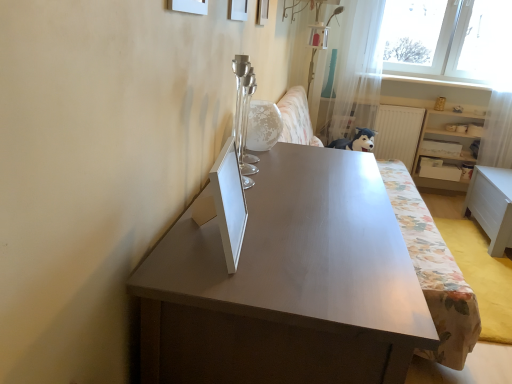
In order to click on white glossy globe at center in this screenshot , I will do tap(262, 126).

What are the coordinates of `white matte picture frame at upper center, arranged as the first picture frame when viewed from the left` in the screenshot? It's located at (189, 6).

You are a GUI agent. You are given a task and a screenshot of the screen. Output one action in this format:
    pyautogui.click(x=<x>, y=<y>)
    Task: Click on the white wooden shelf at right
    The image size is (512, 384).
    Given the screenshot: What is the action you would take?
    pyautogui.click(x=445, y=142)

What do you see at coordinates (445, 142) in the screenshot?
I see `white wooden shelf at right` at bounding box center [445, 142].

What is the approximate height of matte gray table at center, the second table viewed from the back?

The height of matte gray table at center, the second table viewed from the back, is 95.28 centimeters.

You are a GUI agent. You are given a task and a screenshot of the screen. Output one action in this format:
    pyautogui.click(x=<x>, y=<y>)
    Task: Click on the white matte picture frame at upper center, which is the second picture frame from front to back
    Image resolution: width=512 pixels, height=384 pixels.
    Given the screenshot: What is the action you would take?
    pyautogui.click(x=238, y=10)

From the image's perspective, which one is positioned lower, white matte drawer at right or white matte picture frame at upper center, arranged as the 3th picture frame when viewed from the front?

white matte drawer at right is shown below in the image.

Which of these two, white matte drawer at right or white matte picture frame at upper center, arranged as the 3th picture frame when viewed from the front, is thinner?

Thinner between the two is white matte picture frame at upper center, arranged as the 3th picture frame when viewed from the front.

This screenshot has width=512, height=384. In order to click on the 1st picture frame counting from the left side of the white matte drawer at right in this screenshot , I will do `click(262, 12)`.

Does floral fabric couch at center turn towards translucent fabric curtain at upper right?

No, floral fabric couch at center is not facing towards translucent fabric curtain at upper right.

Can you tell me how much floral fabric couch at center and translucent fabric curtain at upper right differ in facing direction?

The facing directions of floral fabric couch at center and translucent fabric curtain at upper right are 89.5 degrees apart.

Looking at this image, between floral fabric couch at center and translucent fabric curtain at upper right, which one has smaller size?

Smaller between the two is translucent fabric curtain at upper right.

Can you confirm if floral fabric couch at center is positioned to the left of translucent fabric curtain at upper right?

Indeed, floral fabric couch at center is positioned on the left side of translucent fabric curtain at upper right.

From the image's perspective, is white matte picture frame at upper center, the second picture frame positioned from the right, under white glossy globe at center?

Actually, white matte picture frame at upper center, the second picture frame positioned from the right, appears above white glossy globe at center in the image.

Choose the correct answer: Is white matte picture frame at upper center, the second picture frame positioned from the right, inside white glossy globe at center or outside it?

The correct answer is: outside.

Is white matte picture frame at upper center, the second picture frame positioned from the right, aimed at white glossy globe at center?

No, white matte picture frame at upper center, the second picture frame positioned from the right, is not turned towards white glossy globe at center.

Is white wooden shelf at right at the left side of floral fabric couch at center?

No.

Considering the relative sizes of white wooden shelf at right and floral fabric couch at center in the image provided, is white wooden shelf at right taller than floral fabric couch at center?

No, white wooden shelf at right is not taller than floral fabric couch at center.

Is white wooden shelf at right next to floral fabric couch at center?

No, white wooden shelf at right is not with floral fabric couch at center.

From the image's perspective, which one is positioned higher, white wooden shelf at right or floral fabric couch at center?

white wooden shelf at right.

Does white matte picture frame at upper center, the 3th picture frame when ordered from left to right, touch white matte drawer at right?

white matte picture frame at upper center, the 3th picture frame when ordered from left to right, and white matte drawer at right are not in contact.

Locate an element on the screen. The height and width of the screenshot is (384, 512). picture frame that is the 1st one above the white matte drawer at right (from a real-world perspective) is located at coordinates (262, 12).

Is point (266, 15) closer to viewer compared to point (423, 165)?

Yes, point (266, 15) is in front of point (423, 165).

Considering the sizes of white matte picture frame at upper center, the 3th picture frame when ordered from left to right, and white matte drawer at right in the image, is white matte picture frame at upper center, the 3th picture frame when ordered from left to right, bigger or smaller than white matte drawer at right?

white matte picture frame at upper center, the 3th picture frame when ordered from left to right, is smaller than white matte drawer at right.

Considering the relative sizes of white glossy globe at center and floral fabric couch at center in the image provided, is white glossy globe at center taller than floral fabric couch at center?

No.

Is white glossy globe at center aimed at floral fabric couch at center?

No, white glossy globe at center is not facing towards floral fabric couch at center.

Does white glossy globe at center appear on the left side of floral fabric couch at center?

Indeed, white glossy globe at center is positioned on the left side of floral fabric couch at center.

Considering the sizes of objects white glossy globe at center and floral fabric couch at center in the image provided, who is bigger, white glossy globe at center or floral fabric couch at center?

floral fabric couch at center is bigger.

Measure the distance from white glossy globe at center to white matte picture frame at upper center, arranged as the 3th picture frame when viewed from the front.

white glossy globe at center and white matte picture frame at upper center, arranged as the 3th picture frame when viewed from the front, are 20.94 inches apart.

Which of these two, white glossy globe at center or white matte picture frame at upper center, the first picture frame from the back, stands shorter?

With less height is white glossy globe at center.

Relative to white matte picture frame at upper center, the first picture frame from the back, is white glossy globe at center in front or behind?

Visually, white glossy globe at center is located in front of white matte picture frame at upper center, the first picture frame from the back.

Is white glossy globe at center inside or outside of white matte picture frame at upper center, the 3th picture frame when ordered from left to right?

white glossy globe at center is not inside white matte picture frame at upper center, the 3th picture frame when ordered from left to right, it's outside.

Where is `drawer that appears behind the white matte picture frame at upper center, the first picture frame from the back`? Image resolution: width=512 pixels, height=384 pixels. drawer that appears behind the white matte picture frame at upper center, the first picture frame from the back is located at coordinates (438, 169).

This screenshot has height=384, width=512. What are the coordinates of `couch below the translucent fabric curtain at upper right (from a real-world perspective)` in the screenshot? It's located at [433, 269].

Based on their spatial positions, is white glossy table at lower right, positioned as the 1th table in back-to-front order, or white matte picture frame at upper center, the 1th picture frame in the right-to-left sequence, closer to matte gray table at center, which is the first table from left to right?

white matte picture frame at upper center, the 1th picture frame in the right-to-left sequence, lies closer to matte gray table at center, which is the first table from left to right, than the other object.

When comparing their distances from white wooden shelf at right, does white matte drawer at right or white glossy table at lower right, placed as the second table when sorted from front to back, seem further?

white glossy table at lower right, placed as the second table when sorted from front to back.

Looking at the image, which one is located further to white wooden shelf at right, matte gray table at center, the second table viewed from the back, or white matte picture frame at upper center, the 1th picture frame in the right-to-left sequence?

matte gray table at center, the second table viewed from the back.

Looking at the image, which one is located closer to matte gray table at center, the second table viewed from the back, translucent fabric curtain at upper right or white matte picture frame at upper center, arranged as the first picture frame when viewed from the left?

white matte picture frame at upper center, arranged as the first picture frame when viewed from the left, is positioned closer to the anchor matte gray table at center, the second table viewed from the back.

Estimate the real-world distances between objects in this image. Which object is further from translucent fabric curtain at upper right, white glossy globe at center or white matte drawer at right?

Based on the image, white glossy globe at center appears to be further to translucent fabric curtain at upper right.

Looking at the image, which one is located further to white matte drawer at right, translucent fabric curtain at upper right or white glossy table at lower right, which is the first table from right to left?

The object further to white matte drawer at right is translucent fabric curtain at upper right.

Looking at the image, which one is located further to white glossy table at lower right, positioned as the 1th table in back-to-front order, matte gray table at center, acting as the 1th table starting from the front, or white wooden shelf at right?

Among the two, matte gray table at center, acting as the 1th table starting from the front, is located further to white glossy table at lower right, positioned as the 1th table in back-to-front order.

Considering their positions, is white matte picture frame at upper center, which is counted as the second picture frame, starting from the left, positioned further to white matte picture frame at upper center, which is the 3th picture frame from right to left, than white matte picture frame at upper center, the 3th picture frame when ordered from left to right?

white matte picture frame at upper center, the 3th picture frame when ordered from left to right, is positioned further to the anchor white matte picture frame at upper center, which is the 3th picture frame from right to left.

In order to click on picture frame between white glossy globe at center and white wooden shelf at right in the front-back direction in this screenshot , I will do `click(262, 12)`.

Find the location of `curtain between white matte picture frame at upper center, which appears as the 1th picture frame when viewed from the front, and white wooden shelf at right, along the z-axis`. curtain between white matte picture frame at upper center, which appears as the 1th picture frame when viewed from the front, and white wooden shelf at right, along the z-axis is located at coordinates (355, 73).

Find the location of `table between white glossy globe at center and white glossy table at lower right, which is the first table from right to left, from left to right`. table between white glossy globe at center and white glossy table at lower right, which is the first table from right to left, from left to right is located at coordinates tap(288, 284).

The height and width of the screenshot is (384, 512). I want to click on table positioned between white matte picture frame at upper center, which appears as the 1th picture frame when viewed from the front, and white matte drawer at right from near to far, so click(x=492, y=205).